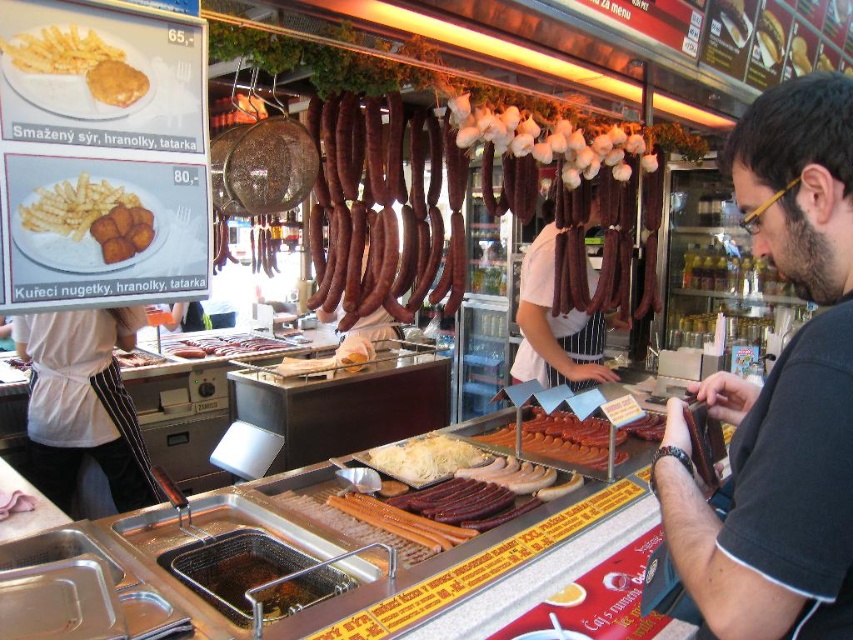
Who is more forward, (97, 356) or (119, 349)?

Point (97, 356) is more forward.

The image size is (853, 640). What do you see at coordinates (83, 403) in the screenshot?
I see `white apron at center` at bounding box center [83, 403].

Find the location of `white apron at center`. white apron at center is located at coordinates (83, 403).

Based on the photo, can you confirm if brown matte sausages at center is bigger than white apron at center?

Correct, brown matte sausages at center is larger in size than white apron at center.

Is brown matte sausages at center to the left of white apron at center from the viewer's perspective?

No, brown matte sausages at center is not to the left of white apron at center.

Which is in front, point (368, 131) or point (70, 339)?

Point (368, 131) is more forward.

Locate an element on the screen. brown matte sausages at center is located at coordinates (393, 212).

Between point (550, 339) and point (80, 186), which one is positioned behind?

Point (550, 339)

Is matte brown sausage at center smaller than golden crispy nugget at left?

No, matte brown sausage at center is not smaller than golden crispy nugget at left.

Is point (540, 346) positioned after point (90, 209)?

Yes, point (540, 346) is farther from viewer.

The width and height of the screenshot is (853, 640). I want to click on matte brown sausage at center, so click(555, 326).